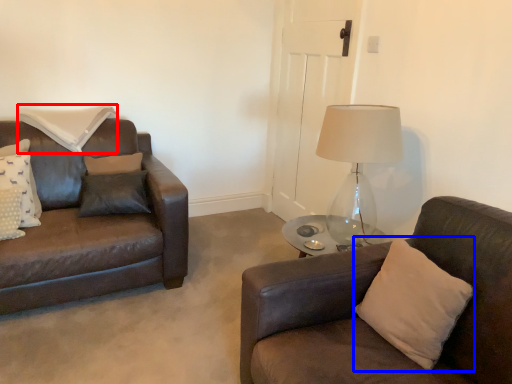
Question: Which object is closer to the camera taking this photo, pillow (highlighted by a red box) or pillow (highlighted by a blue box)?

Choices:
 (A) pillow
 (B) pillow

Answer: (B)